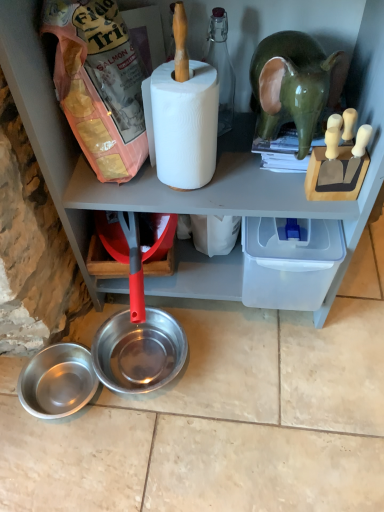
Question: Does matte pink plastic bag of dog food at upper left appear on the right side of brushed metal bowl at lower left, the 1th bowl positioned from the left?

Choices:
 (A) no
 (B) yes

Answer: (B)

Question: Is matte pink plastic bag of dog food at upper left next to brushed metal bowl at lower left, the 1th bowl positioned from the left?

Choices:
 (A) yes
 (B) no

Answer: (B)

Question: Is matte pink plastic bag of dog food at upper left facing away from brushed metal bowl at lower left, which appears as the 2th bowl when viewed from the right?

Choices:
 (A) no
 (B) yes

Answer: (A)

Question: Is matte pink plastic bag of dog food at upper left to the left of brushed metal bowl at lower left, the 1th bowl positioned from the left, from the viewer's perspective?

Choices:
 (A) yes
 (B) no

Answer: (B)

Question: From the image's perspective, would you say matte pink plastic bag of dog food at upper left is positioned over brushed metal bowl at lower left, the 1th bowl positioned from the left?

Choices:
 (A) no
 (B) yes

Answer: (B)

Question: Is matte pink plastic bag of dog food at upper left positioned far away from brushed metal bowl at lower left, which appears as the 2th bowl when viewed from the right?

Choices:
 (A) no
 (B) yes

Answer: (A)

Question: Does brushed metal bowl at lower left, which appears as the 2th bowl when viewed from the right, lie behind green glossy elephant at upper right?

Choices:
 (A) yes
 (B) no

Answer: (A)

Question: Is brushed metal bowl at lower left, which appears as the 2th bowl when viewed from the right, positioned beyond the bounds of green glossy elephant at upper right?

Choices:
 (A) yes
 (B) no

Answer: (A)

Question: Does brushed metal bowl at lower left, which appears as the 2th bowl when viewed from the right, have a greater width compared to green glossy elephant at upper right?

Choices:
 (A) no
 (B) yes

Answer: (A)

Question: Is green glossy elephant at upper right surrounded by brushed metal bowl at lower left, the 1th bowl positioned from the left?

Choices:
 (A) no
 (B) yes

Answer: (A)

Question: Is brushed metal bowl at lower left, which appears as the 2th bowl when viewed from the right, next to green glossy elephant at upper right and touching it?

Choices:
 (A) yes
 (B) no

Answer: (B)

Question: From the image's perspective, is brushed metal bowl at lower left, which appears as the 2th bowl when viewed from the right, above green glossy elephant at upper right?

Choices:
 (A) yes
 (B) no

Answer: (B)

Question: From a real-world perspective, is green glossy elephant at upper right physically above white matte paper towel at center?

Choices:
 (A) yes
 (B) no

Answer: (B)